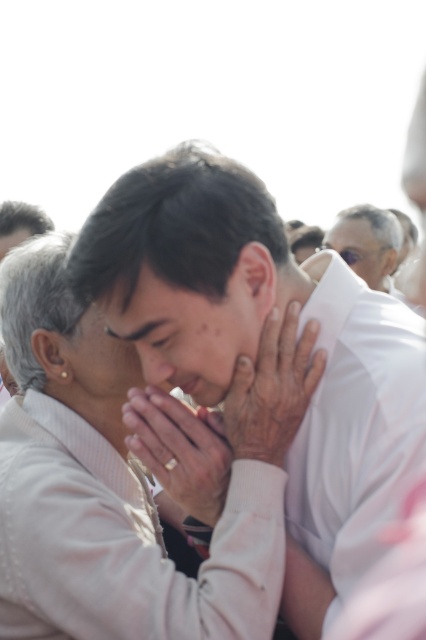
You are a photographer trying to capture the central figures in the image. The point at coordinates [256,348] is crucial for focusing the shot. What object is located at this point?

The point at coordinates [256,348] corresponds to the white matte shirt at center.

You are a photographer standing at a certain distance from the white matte shirt at center. If you want to take a clear photo of it without using a zoom lens, what should you do?

The white matte shirt at center is 4.38 meters away from the camera. To capture a clear photo without a zoom lens, you should move closer to the white matte shirt at center until it fills the frame appropriately.